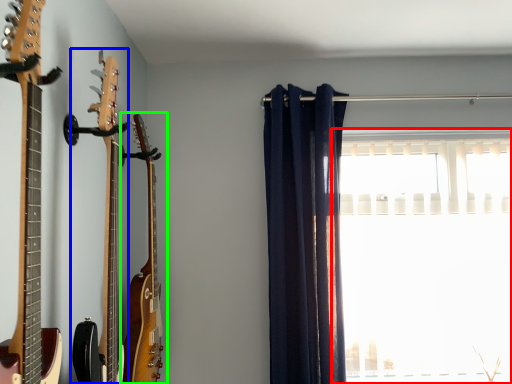
Question: Which object is positioned closest to window (highlighted by a red box)? Select from guitar (highlighted by a blue box) and guitar (highlighted by a green box).

Choices:
 (A) guitar
 (B) guitar

Answer: (B)